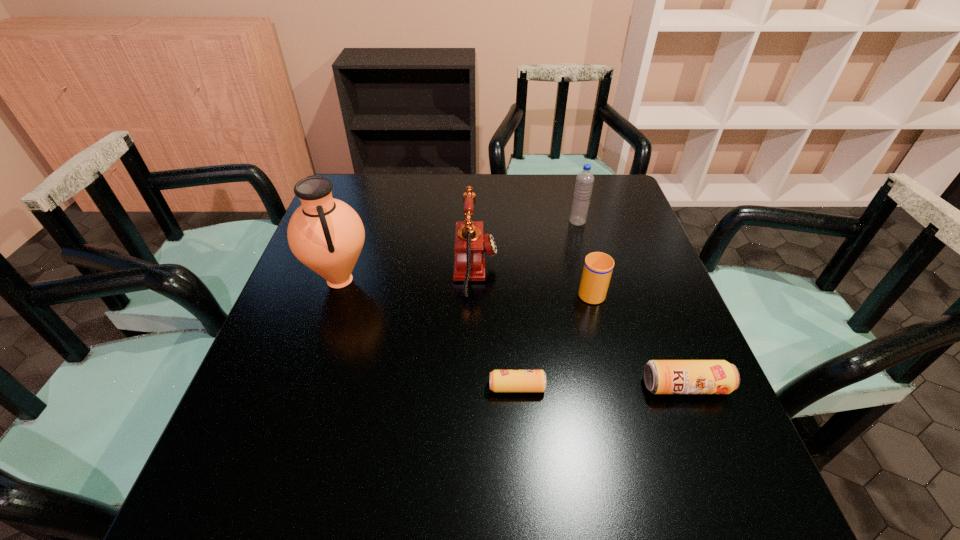
The image size is (960, 540). In order to click on blank space that satisfies the following two spatial constraints: 1. on the dial of the telephone; 2. on the side of the cup with the handle in this screenshot , I will do `click(475, 291)`.

This screenshot has height=540, width=960. I want to click on free space that satisfies the following two spatial constraints: 1. on the dial of the telephone; 2. on the back side of the right beer can, so click(474, 387).